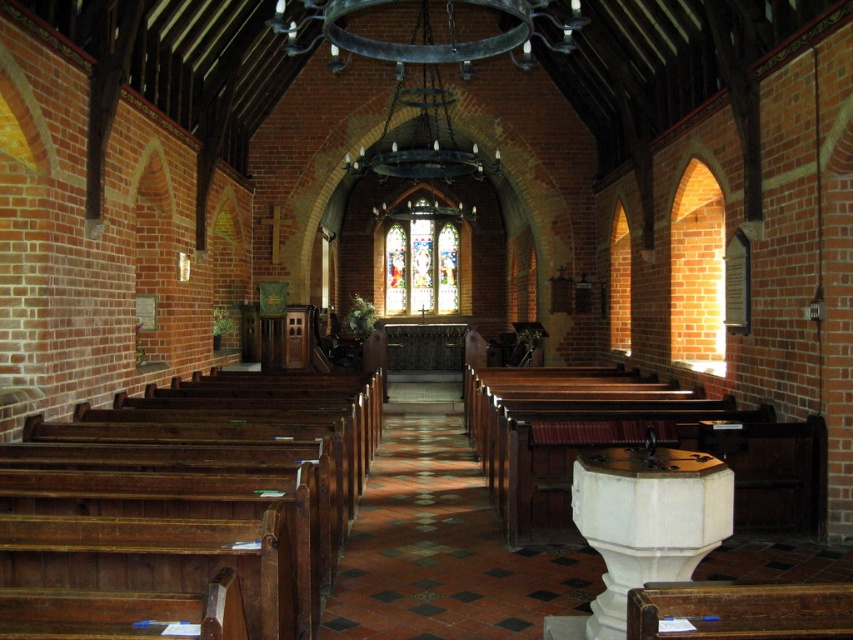
You are standing at the entrance of the church and want to locate two specific points marked in the image. The first point is at coordinates point (242,420) and the second is at point (386,307). Which of these two points is closer to the entrance?

Point (242,420) is in front of point (386,307), so it is closer to the entrance.

You are an interior designer planning to place a 2.5 meter wide decorative archway in the church. You have two options for placement locations based on the available space. Which object, dark brown wood pews at left or stained glass at center, has a larger width to accommodate the archway?

The dark brown wood pews at left has a larger width than the stained glass at center, so the archway can be placed there.

In the scene shown: You are standing at the entrance of the church and want to find the dark brown wood pews at left. Based on their coordinates, which direction should you walk to reach them?

The dark brown wood pews at left are located at coordinates point (184, 506), so you should walk towards the left side of the church to reach them.